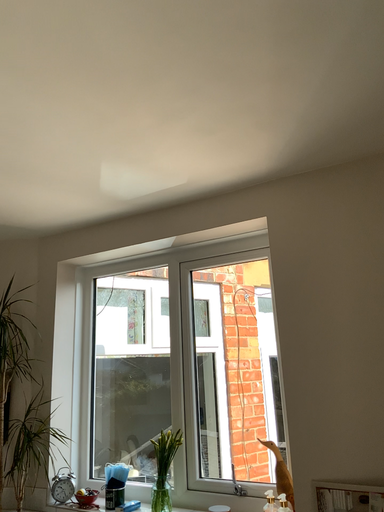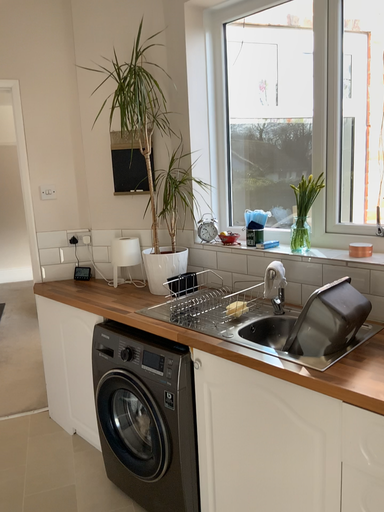
Question: Which way did the camera rotate in the video?

Choices:
 (A) rotated left
 (B) rotated right

Answer: (A)